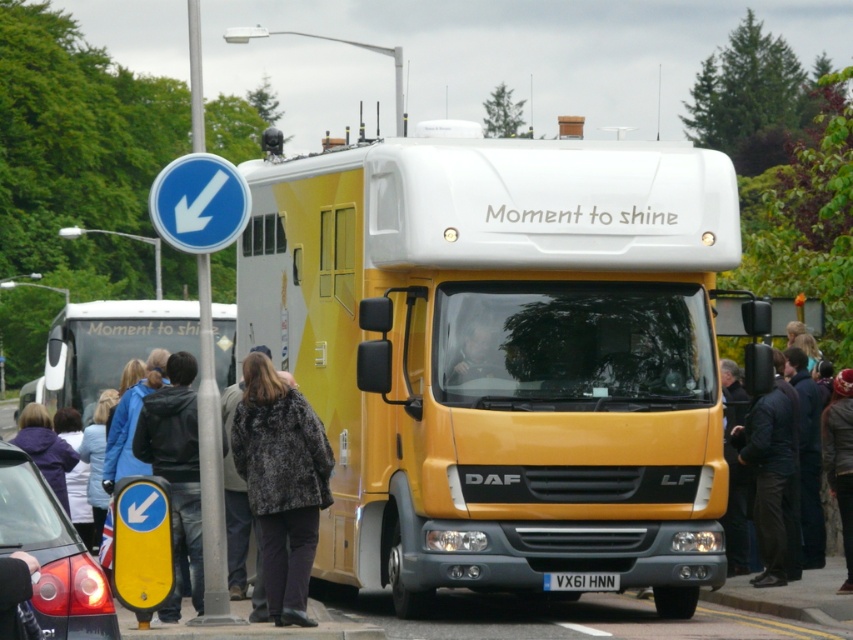
Is point (450, 380) positioned behind point (836, 394)?

No, (450, 380) is closer to viewer.

Does matte yellow truck at center appear over dark gray knit hat at upper left?

Indeed, matte yellow truck at center is positioned over dark gray knit hat at upper left.

Does point (465, 360) come farther from viewer compared to point (845, 403)?

No.

This screenshot has height=640, width=853. I want to click on matte yellow truck at center, so click(471, 344).

Can you confirm if fuzzy black coat at center is taller than black plastic license plate at center?

Yes, fuzzy black coat at center is taller than black plastic license plate at center.

Does point (264, 481) come behind point (596, 579)?

No, it is in front of (596, 579).

Image resolution: width=853 pixels, height=640 pixels. I want to click on fuzzy black coat at center, so click(281, 483).

Does yellow matte bus at center have a lesser height compared to fuzzy black coat at center?

In fact, yellow matte bus at center may be taller than fuzzy black coat at center.

Where is `yellow matte bus at center`? This screenshot has width=853, height=640. yellow matte bus at center is located at coordinates (506, 356).

This screenshot has width=853, height=640. Identify the location of yellow matte bus at center. (506, 356).